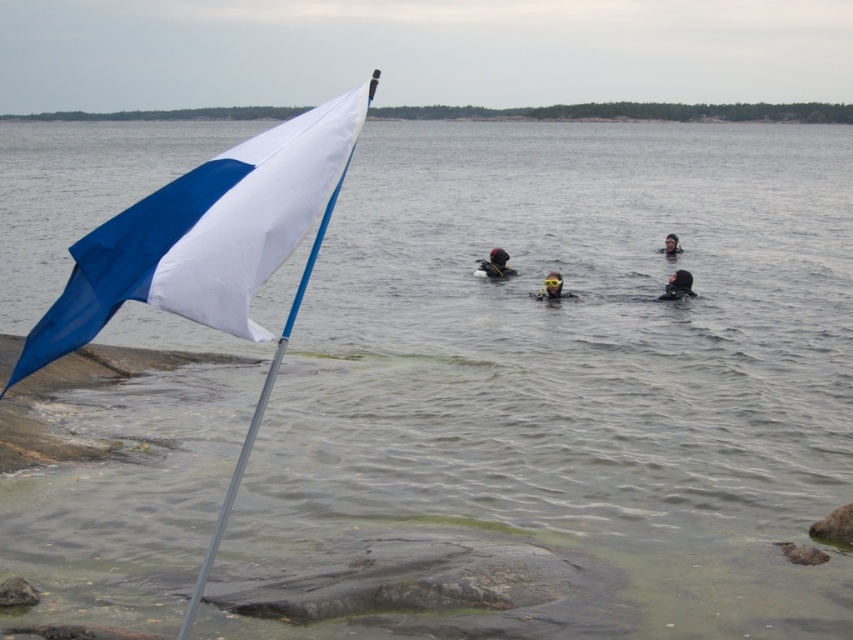
Question: Which object is closer to the camera taking this photo?

Choices:
 (A) blue fabric flag at left
 (B) black matte scuba diver at center

Answer: (A)

Question: Which point is farther to the camera?

Choices:
 (A) yellow matte helmet at center
 (B) black matte scuba diver at center
 (C) matte black wetsuit at center
 (D) blue fabric flag at left

Answer: (B)

Question: Does black rubber wetsuit at center appear over black matte scuba diver at center?

Choices:
 (A) no
 (B) yes

Answer: (A)

Question: Which point is closer to the camera?

Choices:
 (A) (672, 252)
 (B) (666, 294)

Answer: (B)

Question: In this image, where is black rubber wetsuit at center located relative to yellow matte helmet at center?

Choices:
 (A) left
 (B) right

Answer: (B)

Question: Considering the relative positions of yellow matte helmet at center and black matte scuba diver at center in the image provided, where is yellow matte helmet at center located with respect to black matte scuba diver at center?

Choices:
 (A) left
 (B) right

Answer: (A)